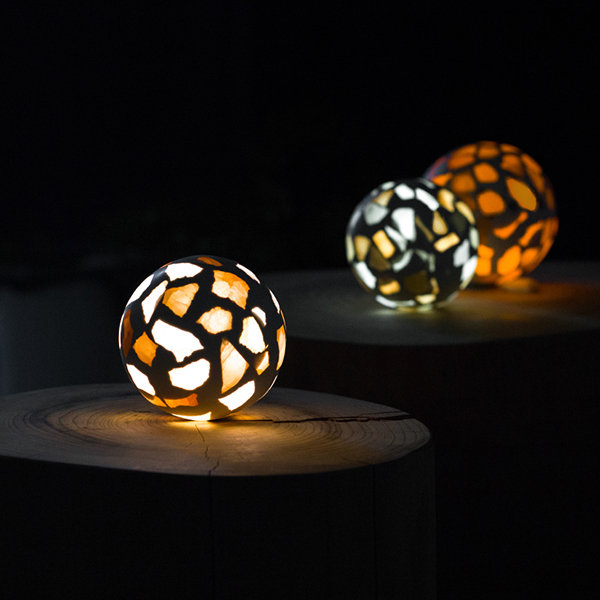
Find the location of `wood table`. wood table is located at coordinates (479, 322).